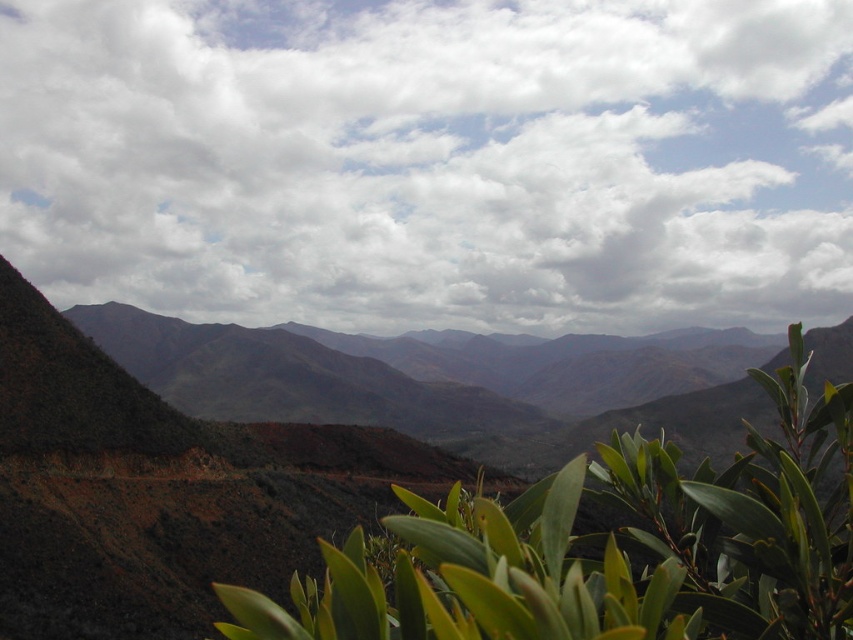
From the picture: Is the position of white fluffy cloud at upper center less distant than that of green leafy plant at center?

No, it is behind green leafy plant at center.

Can you confirm if white fluffy cloud at upper center is positioned to the left of green leafy plant at center?

Indeed, white fluffy cloud at upper center is positioned on the left side of green leafy plant at center.

Image resolution: width=853 pixels, height=640 pixels. What do you see at coordinates (432, 161) in the screenshot?
I see `white fluffy cloud at upper center` at bounding box center [432, 161].

Locate an element on the screen. The width and height of the screenshot is (853, 640). white fluffy cloud at upper center is located at coordinates (432, 161).